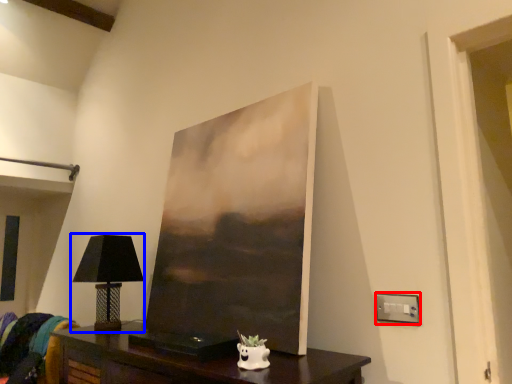
Question: Which of the following is the closest to the observer, electric outlet (highlighted by a red box) or table lamp (highlighted by a blue box)?

Choices:
 (A) electric outlet
 (B) table lamp

Answer: (A)